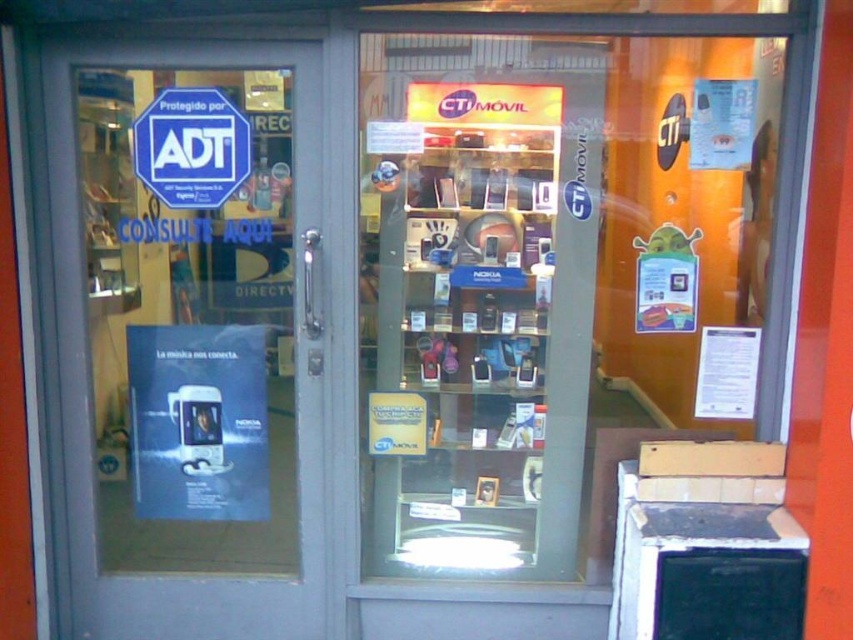
Question: Does gray glass door at left have a smaller size compared to blue plastic sign at upper left?

Choices:
 (A) yes
 (B) no

Answer: (B)

Question: Which object appears closest to the camera in this image?

Choices:
 (A) gray glass door at left
 (B) blue plastic sign at upper left

Answer: (A)

Question: Can you confirm if gray glass door at left is smaller than blue plastic sign at upper left?

Choices:
 (A) no
 (B) yes

Answer: (A)

Question: Which object is closer to the camera taking this photo?

Choices:
 (A) gray glass door at left
 (B) blue plastic sign at upper left

Answer: (A)

Question: Which object appears closest to the camera in this image?

Choices:
 (A) gray glass door at left
 (B) blue plastic sign at upper left

Answer: (A)

Question: Does gray glass door at left appear over blue plastic sign at upper left?

Choices:
 (A) yes
 (B) no

Answer: (B)